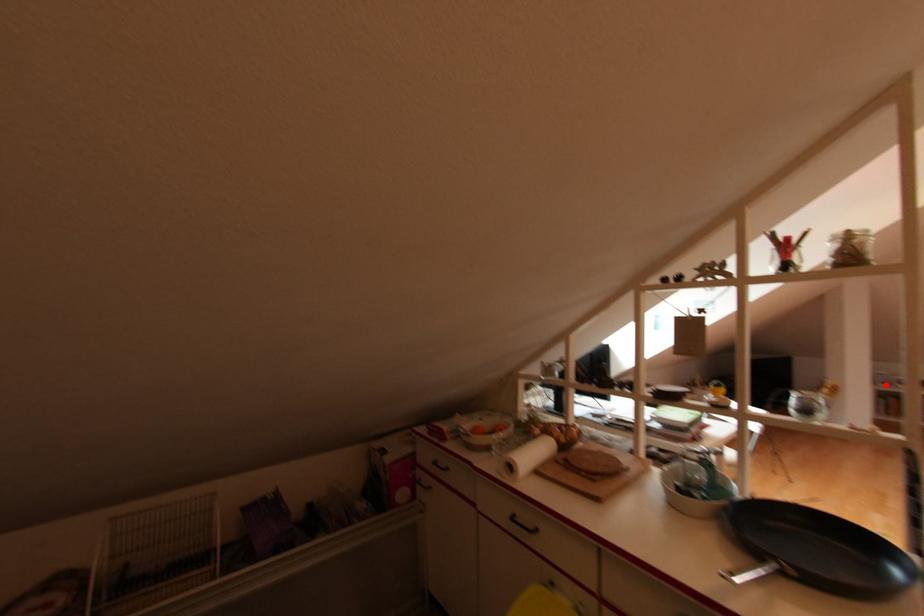
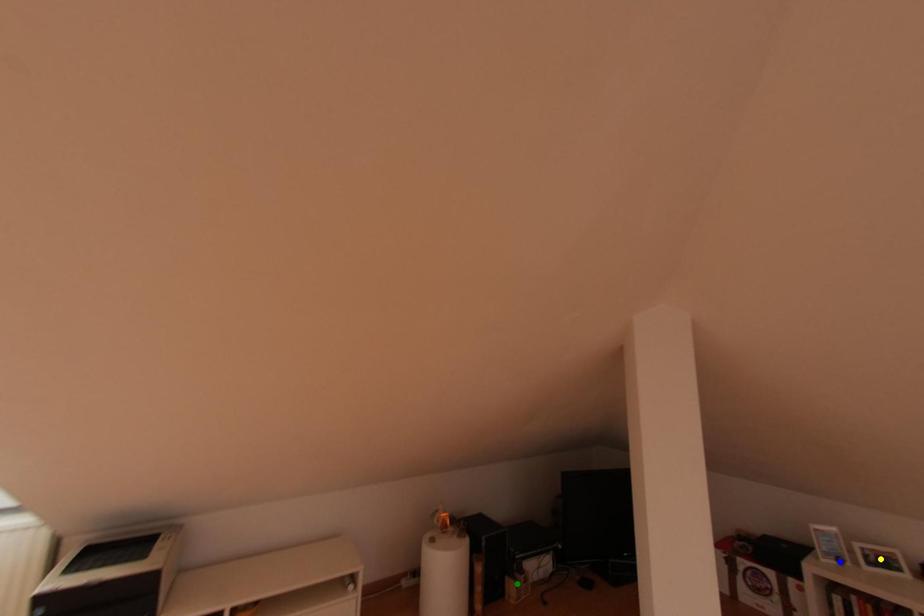
Question: I am providing you with two images of the same scene from different viewpoints. A red point is marked on the first image. You are given multiple points on the second image. Which mark in image 2 goes with the point in image 1?

Choices:
 (A) blue point
 (B) yellow point
 (C) green point

Answer: (A)